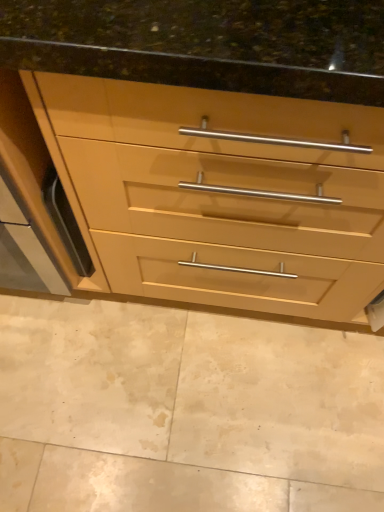
Question: Is matte wood chest of drawers at center taller or shorter than beige marble floor at lower center?

Choices:
 (A) tall
 (B) short

Answer: (A)

Question: Looking at their shapes, would you say matte wood chest of drawers at center is wider or thinner than beige marble floor at lower center?

Choices:
 (A) thin
 (B) wide

Answer: (A)

Question: From the image's perspective, is matte wood chest of drawers at center above or below beige marble floor at lower center?

Choices:
 (A) below
 (B) above

Answer: (B)

Question: Considering the positions of beige marble floor at lower center and matte wood chest of drawers at center in the image, is beige marble floor at lower center bigger or smaller than matte wood chest of drawers at center?

Choices:
 (A) small
 (B) big

Answer: (A)

Question: From a real-world perspective, is beige marble floor at lower center above or below matte wood chest of drawers at center?

Choices:
 (A) below
 (B) above

Answer: (A)

Question: In the image, is beige marble floor at lower center positioned in front of or behind matte wood chest of drawers at center?

Choices:
 (A) front
 (B) behind

Answer: (B)

Question: Is beige marble floor at lower center inside or outside of matte wood chest of drawers at center?

Choices:
 (A) inside
 (B) outside

Answer: (B)